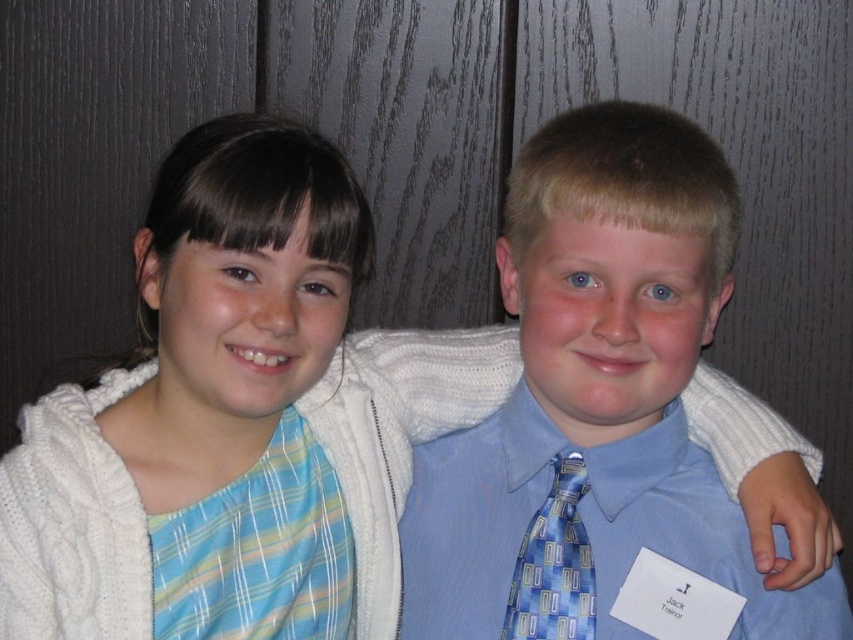
You are a photographer who needs to adjust the focus between the blue satin tie at center and the camera. Which object should you focus on first if the camera can only focus on one object at a time and the focus distance is set to 29.22 inches?

The blue satin tie at center is exactly 29.22 inches away from the camera, so you should focus on the blue satin tie at center first since it is at the focus distance.

What is located at the coordinates point (595, 401)?

The blue satin tie at center is located at point (595, 401).

You are a tailor inspecting two ties displayed side by side in a store window. The blue satin tie at center and the blue printed tie at center are both on display. Which tie has a taller design?

The blue satin tie at center has a greater height compared to the blue printed tie at center, so the blue satin tie at center is taller.